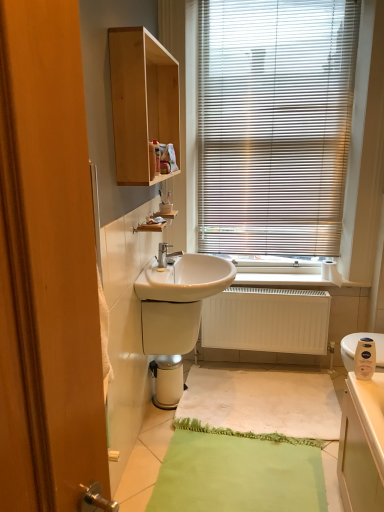
Question: From the image's perspective, is wooden cabinet at left below light wood cabinet at upper center?

Choices:
 (A) yes
 (B) no

Answer: (A)

Question: From the image's perspective, would you say wooden cabinet at left is positioned over light wood cabinet at upper center?

Choices:
 (A) yes
 (B) no

Answer: (B)

Question: Could you tell me if wooden cabinet at left is facing light wood cabinet at upper center?

Choices:
 (A) no
 (B) yes

Answer: (A)

Question: Can you confirm if wooden cabinet at left is positioned to the left of light wood cabinet at upper center?

Choices:
 (A) yes
 (B) no

Answer: (A)

Question: Is wooden cabinet at left far from light wood cabinet at upper center?

Choices:
 (A) no
 (B) yes

Answer: (B)

Question: Can you confirm if wooden cabinet at left is shorter than light wood cabinet at upper center?

Choices:
 (A) yes
 (B) no

Answer: (B)

Question: Is matte plastic soap dispenser at lower right placed right next to light wood cabinet at upper center?

Choices:
 (A) no
 (B) yes

Answer: (A)

Question: From the image's perspective, is matte plastic soap dispenser at lower right located beneath light wood cabinet at upper center?

Choices:
 (A) no
 (B) yes

Answer: (B)

Question: Does matte plastic soap dispenser at lower right have a greater height compared to light wood cabinet at upper center?

Choices:
 (A) yes
 (B) no

Answer: (B)

Question: Considering the relative positions of matte plastic soap dispenser at lower right and light wood cabinet at upper center in the image provided, is matte plastic soap dispenser at lower right to the right of light wood cabinet at upper center from the viewer's perspective?

Choices:
 (A) no
 (B) yes

Answer: (B)

Question: Can you confirm if matte plastic soap dispenser at lower right is bigger than light wood cabinet at upper center?

Choices:
 (A) no
 (B) yes

Answer: (A)

Question: Is matte plastic soap dispenser at lower right facing towards light wood cabinet at upper center?

Choices:
 (A) no
 (B) yes

Answer: (A)

Question: Is matte plastic soap dispenser at lower right shorter than wooden cabinet at left?

Choices:
 (A) no
 (B) yes

Answer: (B)